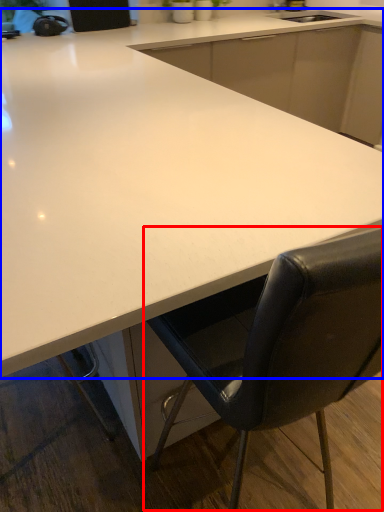
Question: Which point is closer to the camera, chair (highlighted by a red box) or countertop (highlighted by a blue box)?

Choices:
 (A) chair
 (B) countertop

Answer: (A)